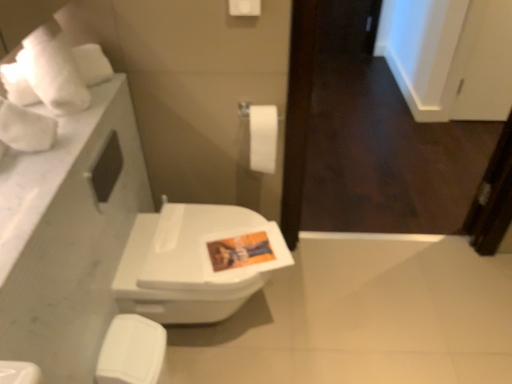
Question: Is white matte toilet paper at center taller or shorter than white glossy toilet seat at lower left?

Choices:
 (A) short
 (B) tall

Answer: (A)

Question: Considering their positions, is white matte toilet paper at center located in front of or behind white glossy toilet seat at lower left?

Choices:
 (A) front
 (B) behind

Answer: (B)

Question: Which is nearer to the white matte toilet paper at center?

Choices:
 (A) white glossy toilet seat at lower left
 (B) white glossy toilet at center
 (C) white marble countertop at left

Answer: (B)

Question: Which object is positioned closest to the white glossy toilet seat at lower left?

Choices:
 (A) white glossy toilet at center
 (B) white matte toilet paper at center
 (C) white marble countertop at left

Answer: (A)